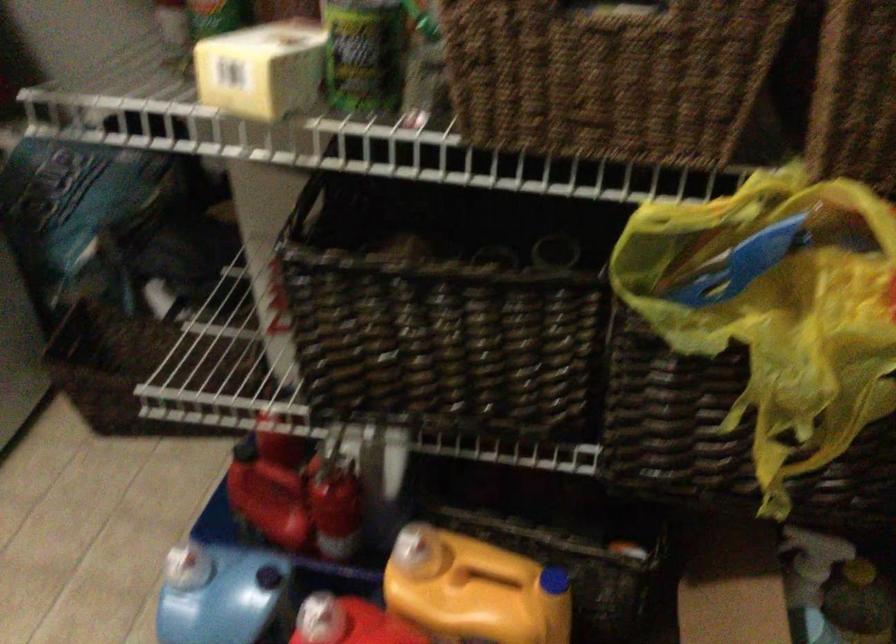
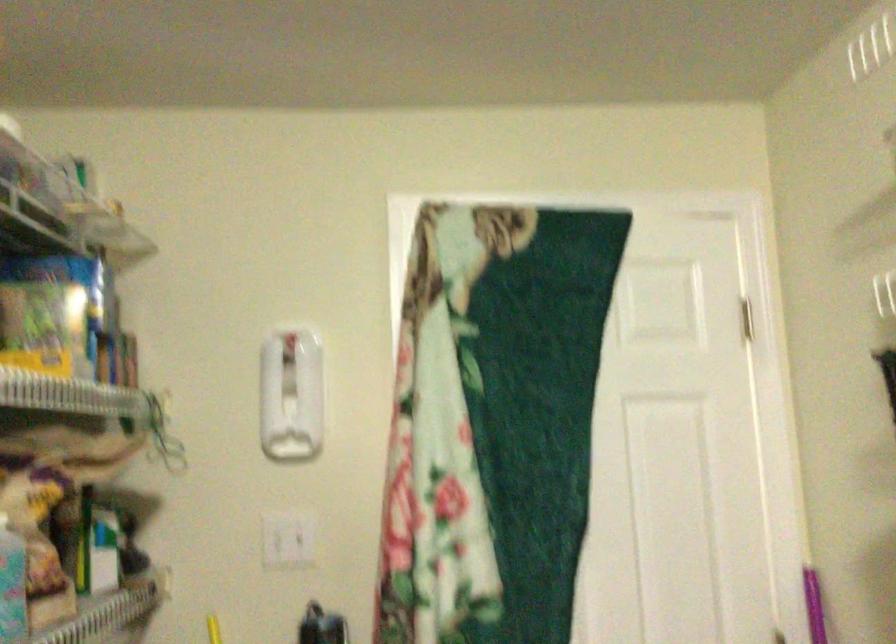
Question: The first image is from the beginning of the video and the second image is from the end. How did the camera likely rotate when shooting the video?

Choices:
 (A) Left
 (B) Right
 (C) Up
 (D) Down

Answer: (B)